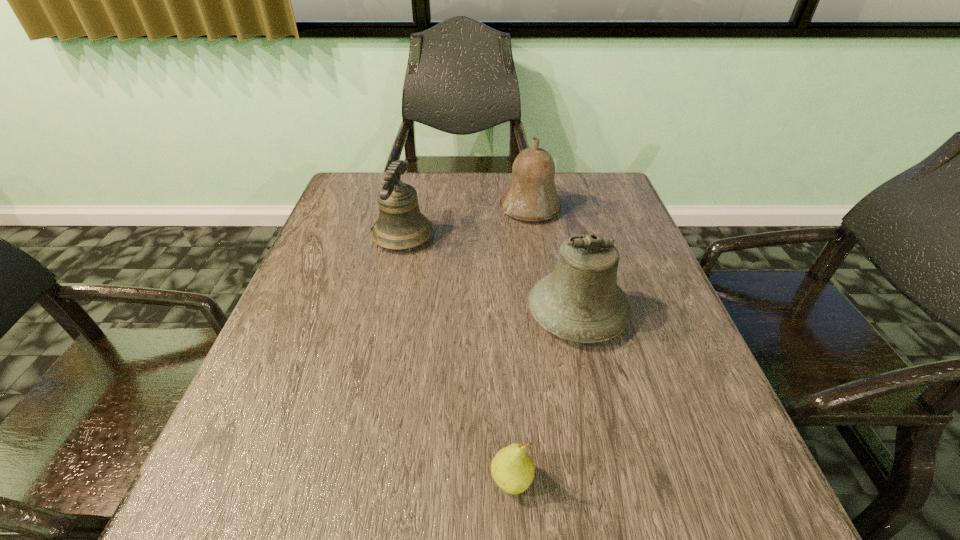
You are a GUI agent. You are given a task and a screenshot of the screen. Output one action in this format:
    pyautogui.click(x=<x>, y=<y>)
    Task: Click on the empty space between the shortest object and the leftmost object
    The image size is (960, 540).
    Given the screenshot: What is the action you would take?
    pyautogui.click(x=457, y=359)

This screenshot has height=540, width=960. In order to click on empty location between the shortest object and the leftmost bell in this screenshot , I will do `click(457, 359)`.

This screenshot has width=960, height=540. Find the location of `the closest object to the leftmost object`. the closest object to the leftmost object is located at coordinates point(531,195).

The height and width of the screenshot is (540, 960). In order to click on object that is the second closest to the leftmost bell in this screenshot , I will do `click(580, 301)`.

I want to click on the second closest bell relative to the leftmost bell, so click(x=580, y=301).

Find the location of `the third closest bell to the shortest object`. the third closest bell to the shortest object is located at coordinates (531, 195).

Locate an element on the screen. vacant space that satisfies the following two spatial constraints: 1. on the front side of the pear; 2. on the right side of the leftmost object is located at coordinates (348, 482).